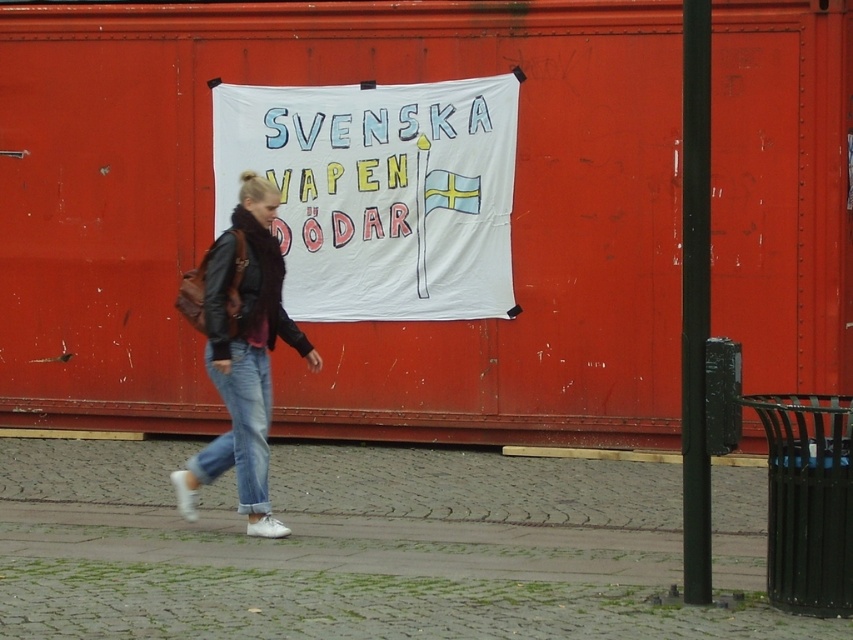
Question: Based on their relative distances, which object is nearer to the white fabric banner at center?

Choices:
 (A) blue denim jeans at lower center
 (B) denim jeans at center

Answer: (B)

Question: Does white fabric banner at center appear over blue denim jeans at lower center?

Choices:
 (A) no
 (B) yes

Answer: (B)

Question: Based on their relative distances, which object is farther from the denim jeans at center?

Choices:
 (A) white fabric banner at center
 (B) blue denim jeans at lower center

Answer: (A)

Question: Is white fabric banner at center to the right of denim jeans at center from the viewer's perspective?

Choices:
 (A) yes
 (B) no

Answer: (A)

Question: Considering the real-world distances, which object is closest to the blue denim jeans at lower center?

Choices:
 (A) denim jeans at center
 (B) white fabric banner at center

Answer: (A)

Question: In this image, where is white fabric banner at center located relative to denim jeans at center?

Choices:
 (A) right
 (B) left

Answer: (A)